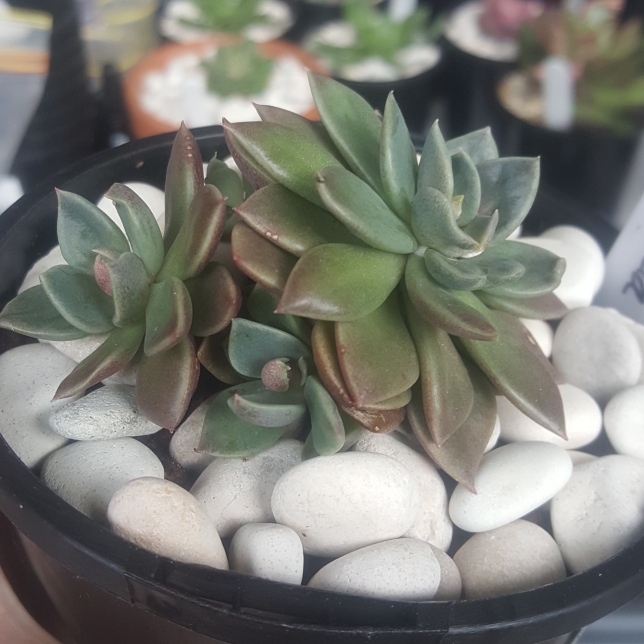
Identify the location of plant. Image resolution: width=644 pixels, height=644 pixels. (418, 252), (162, 277), (281, 354), (252, 66), (241, 12), (395, 28), (621, 99), (583, 26), (502, 20).